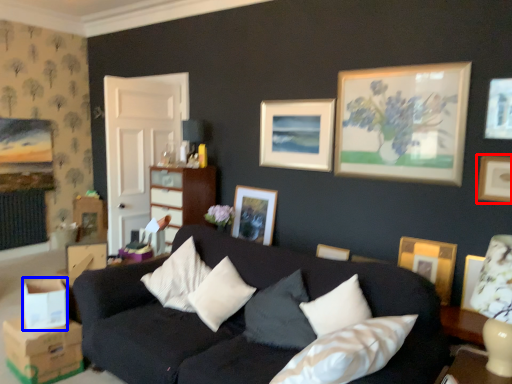
Question: Which point is further to the camera, picture frame (highlighted by a red box) or cardboard box (highlighted by a blue box)?

Choices:
 (A) picture frame
 (B) cardboard box

Answer: (A)